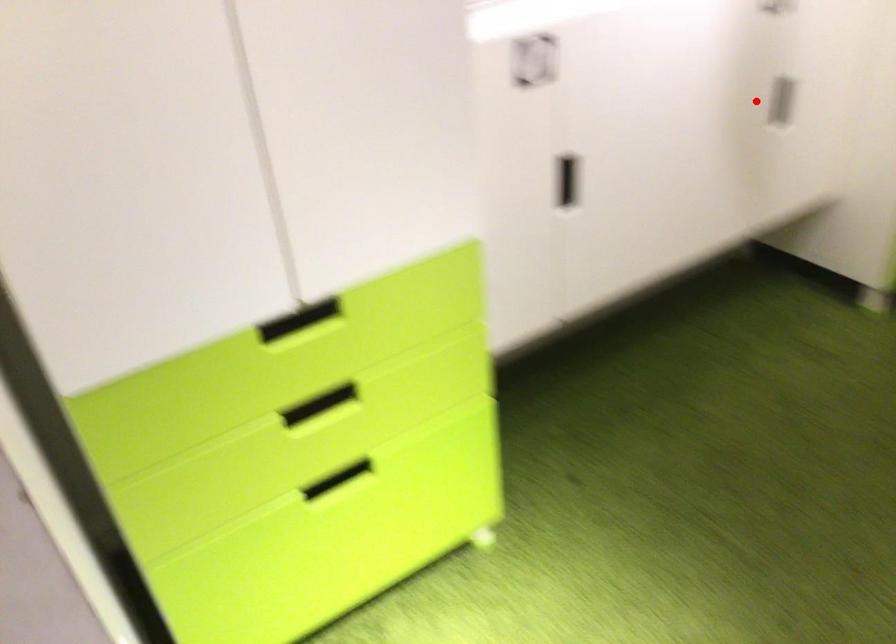
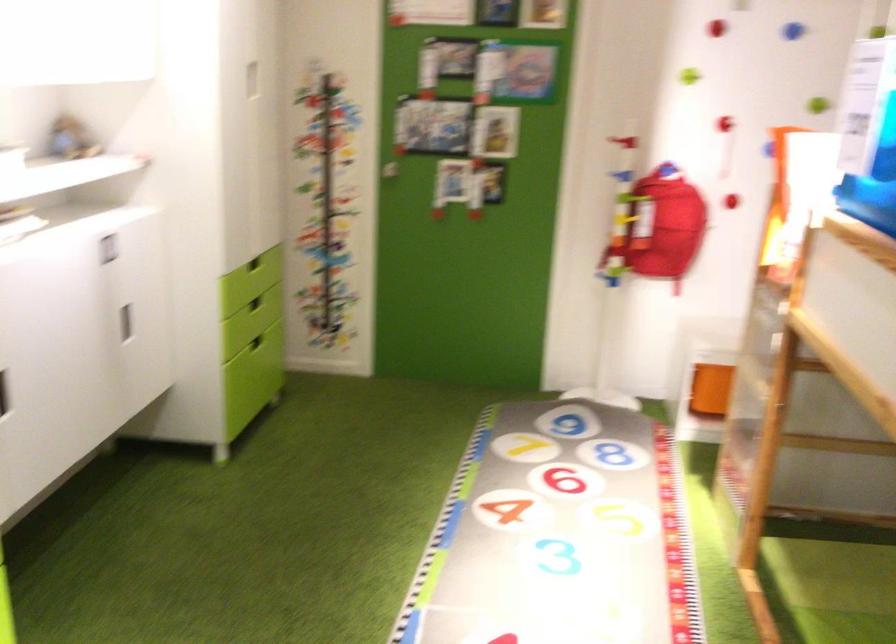
Question: I am providing you with two images of the same scene from different viewpoints. A red point is marked on the first image. Is the red point's position out of view in image 2?

Choices:
 (A) Yes
 (B) No

Answer: (B)